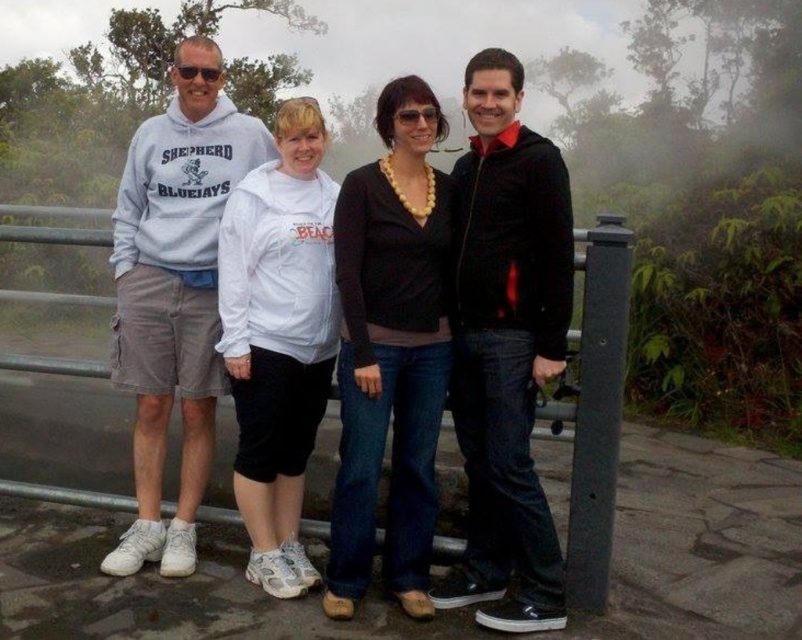
Question: Can you confirm if black matte jacket at center is smaller than matte black sweater at center?

Choices:
 (A) no
 (B) yes

Answer: (A)

Question: Among these objects, which one is nearest to the camera?

Choices:
 (A) matte gray hoodie at left
 (B) gray cotton hoodie at left

Answer: (A)

Question: Which object is farther from the camera taking this photo?

Choices:
 (A) matte black sweater at center
 (B) white fleece jacket at center

Answer: (B)

Question: Which object appears closest to the camera in this image?

Choices:
 (A) white fleece jacket at center
 (B) matte black sweater at center

Answer: (B)

Question: Is matte gray hoodie at left to the right of gray cotton hoodie at left from the viewer's perspective?

Choices:
 (A) no
 (B) yes

Answer: (B)

Question: Is the position of matte black sweater at center more distant than that of white fleece jacket at center?

Choices:
 (A) yes
 (B) no

Answer: (B)